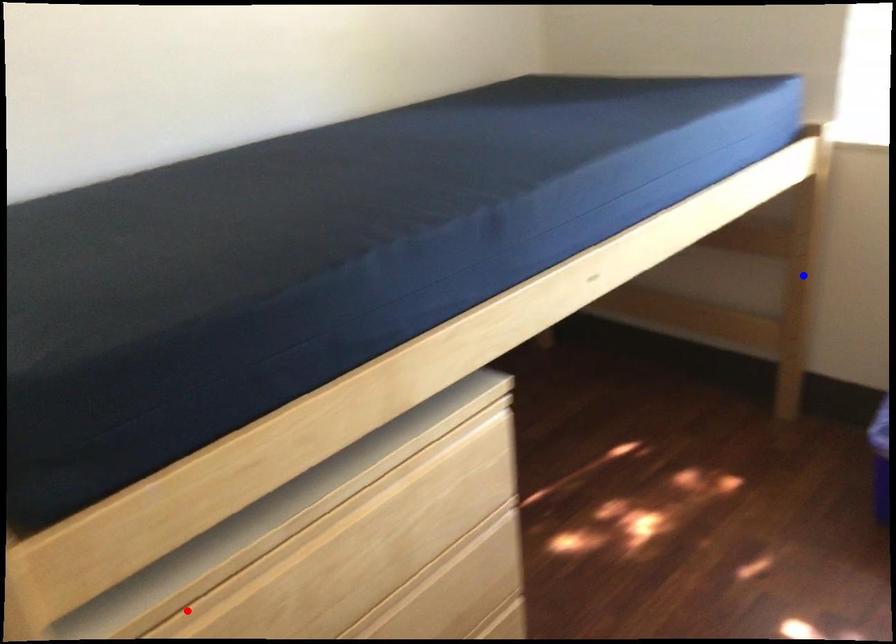
Question: Two points are marked on the image. Which point is closer to the camera?

Choices:
 (A) Blue point is closer.
 (B) Red point is closer.

Answer: (B)